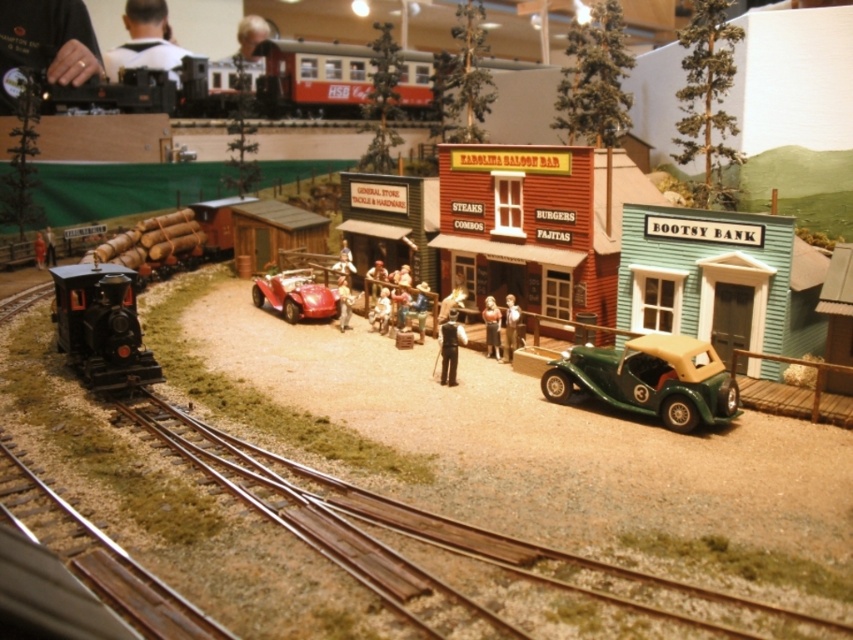
Which is in front, point (642, 358) or point (265, 291)?

Point (642, 358)

Which is above, green matte toy car at center or shiny red car at center?

shiny red car at center is above.

The image size is (853, 640). Find the location of `green matte toy car at center`. green matte toy car at center is located at coordinates (648, 380).

Is point (288, 70) closer to viewer compared to point (254, 284)?

No, it is not.

Which of these two, brushed metal train at upper center or shiny red car at center, stands taller?

brushed metal train at upper center is taller.

Image resolution: width=853 pixels, height=640 pixels. What do you see at coordinates (311, 77) in the screenshot?
I see `brushed metal train at upper center` at bounding box center [311, 77].

You are a GUI agent. You are given a task and a screenshot of the screen. Output one action in this format:
    pyautogui.click(x=<x>, y=<y>)
    Task: Click on the brushed metal train at upper center
    
    Given the screenshot: What is the action you would take?
    pyautogui.click(x=311, y=77)

Is point (230, 92) positioned after point (699, 420)?

Yes.

Based on the photo, between brushed metal train at upper center and green matte toy car at center, which one appears on the left side from the viewer's perspective?

Positioned to the left is brushed metal train at upper center.

Is point (276, 42) closer to viewer compared to point (701, 413)?

That is False.

Identify the location of brushed metal train at upper center. pos(311,77).